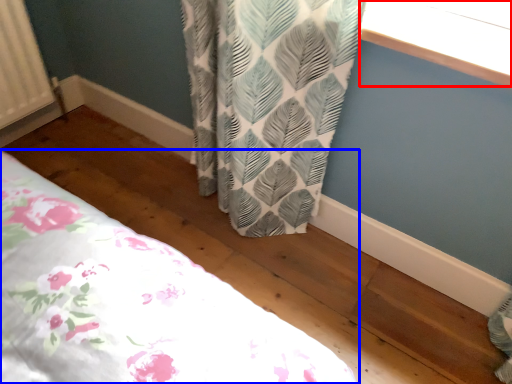
Question: Which of the following is the closest to the observer, window screen (highlighted by a red box) or bed (highlighted by a blue box)?

Choices:
 (A) window screen
 (B) bed

Answer: (A)